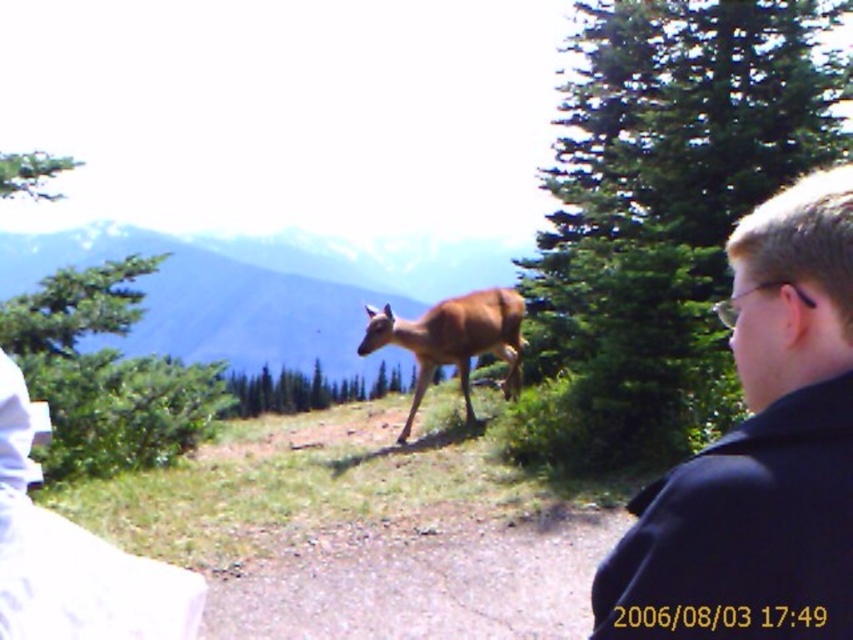
Question: Based on their relative distances, which object is farther from the dark blue jacket at right?

Choices:
 (A) brown fur deer at center
 (B) green textured pine at upper right

Answer: (A)

Question: Can you confirm if dark blue jacket at right is positioned to the right of brown fur deer at center?

Choices:
 (A) yes
 (B) no

Answer: (A)

Question: Is dark blue jacket at right wider than brown matte deer at center?

Choices:
 (A) yes
 (B) no

Answer: (B)

Question: Which point appears closest to the camera in this image?

Choices:
 (A) (299, 355)
 (B) (476, 346)

Answer: (B)

Question: Considering the real-world distances, which object is closest to the brown fur deer at center?

Choices:
 (A) brown matte deer at center
 (B) green textured pine at upper right
 (C) dark blue jacket at right

Answer: (B)

Question: Is the position of green textured pine at upper right more distant than that of dark blue jacket at right?

Choices:
 (A) yes
 (B) no

Answer: (A)